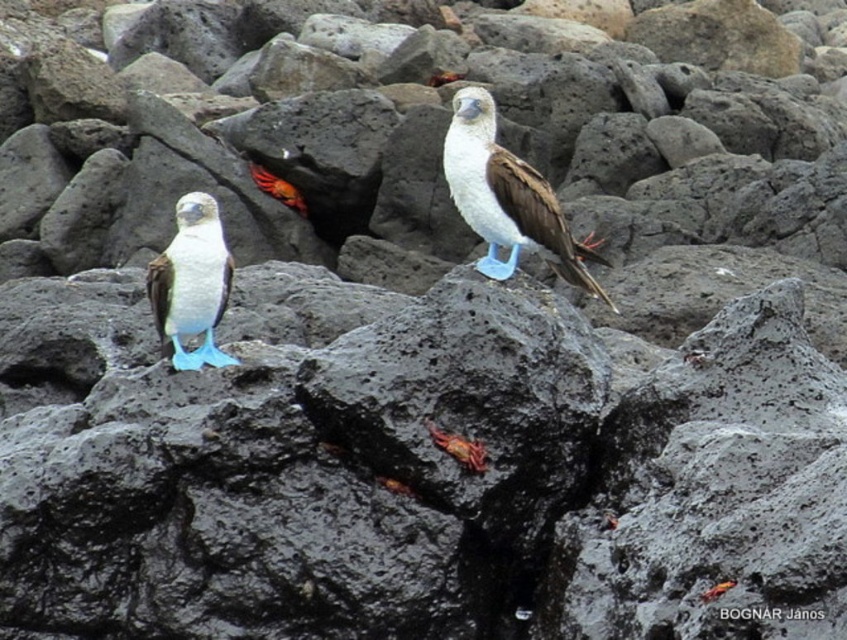
Question: Which point is closer to the camera taking this photo?

Choices:
 (A) (446, 177)
 (B) (253, 161)

Answer: (A)

Question: Which of the following is the closest to the observer?

Choices:
 (A) white matte/blue feet at center
 (B) matte white bird at center

Answer: (B)

Question: Is white matte/blue feet at center above shiny orange crab at center?

Choices:
 (A) no
 (B) yes

Answer: (A)

Question: Does matte white bird at center appear on the left side of shiny orange crab at center?

Choices:
 (A) no
 (B) yes

Answer: (A)

Question: Considering the real-world distances, which object is farthest from the matte white bird at center?

Choices:
 (A) shiny orange crab at center
 (B) white matte/blue feet at center

Answer: (A)

Question: Does white matte/blue feet at center appear on the right side of smooth orange crab at center?

Choices:
 (A) no
 (B) yes

Answer: (B)